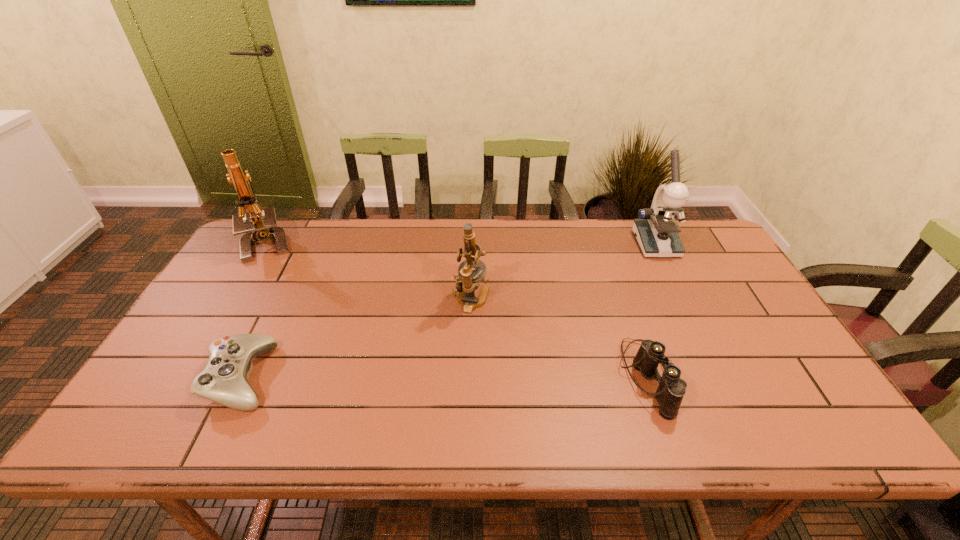
Locate an element on the screen. Image resolution: width=960 pixels, height=540 pixels. the leftmost microscope is located at coordinates (264, 226).

Identify the location of the rightmost object. Image resolution: width=960 pixels, height=540 pixels. (656, 230).

The image size is (960, 540). I want to click on the nearest microscope, so click(x=467, y=283).

The width and height of the screenshot is (960, 540). Identify the location of the third object from right to left. (467, 283).

Where is `the fourth object from left to right`? the fourth object from left to right is located at coordinates (671, 389).

I want to click on binoculars, so click(671, 389).

The image size is (960, 540). In order to click on the shortest object in this screenshot , I will do `click(224, 380)`.

This screenshot has width=960, height=540. I want to click on free space located 0.150m at the eyepiece of the leftmost microscope, so click(236, 296).

The height and width of the screenshot is (540, 960). What are the coordinates of `vacant space situated 0.330m on the front of the rightmost microscope` in the screenshot? It's located at (702, 337).

Find the location of a particular element. The width and height of the screenshot is (960, 540). free space located on the back of the second microscope from right to left is located at coordinates (472, 258).